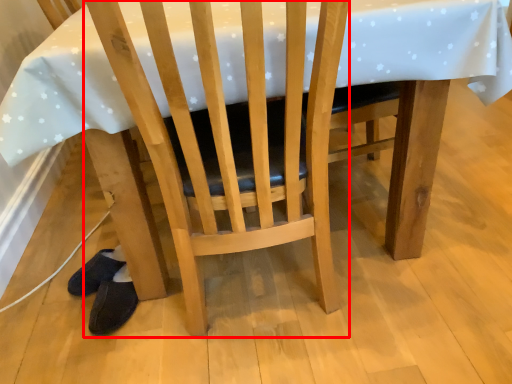
Question: Where is chair (annotated by the red box) located in relation to footwear in the image?

Choices:
 (A) left
 (B) right

Answer: (B)